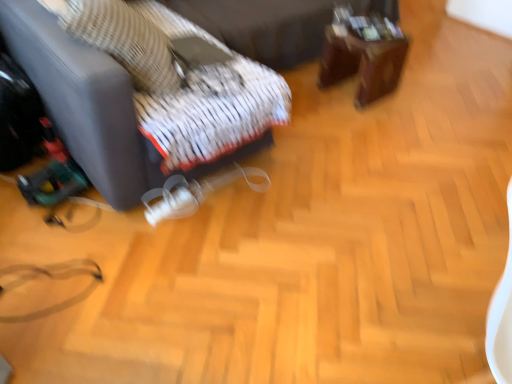
At what (x,y) coordinates should I click in order to perform the action: click on vacant space to the left of brown wooden table at upper right. Please return your answer as a coordinate pair (x, y). This screenshot has height=384, width=512. Looking at the image, I should click on (309, 100).